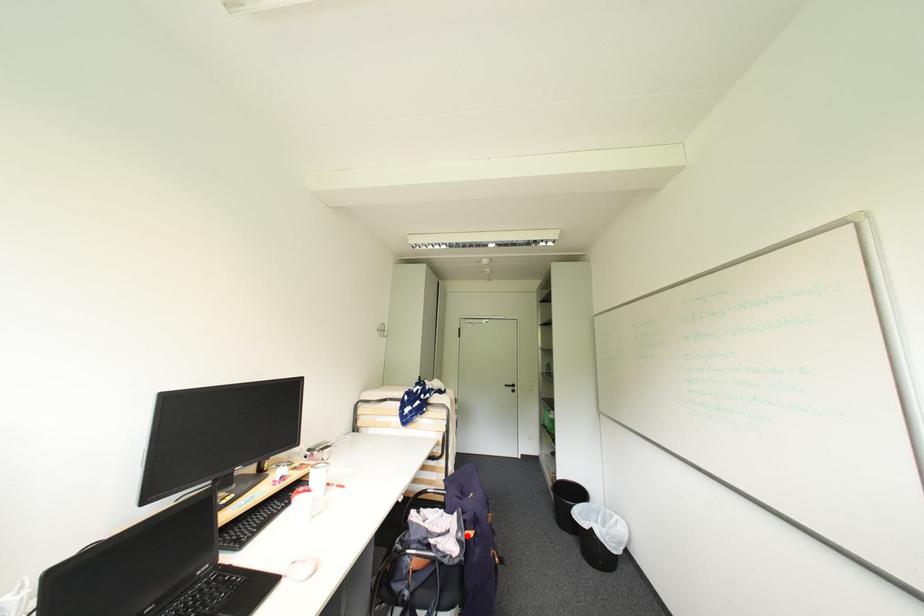
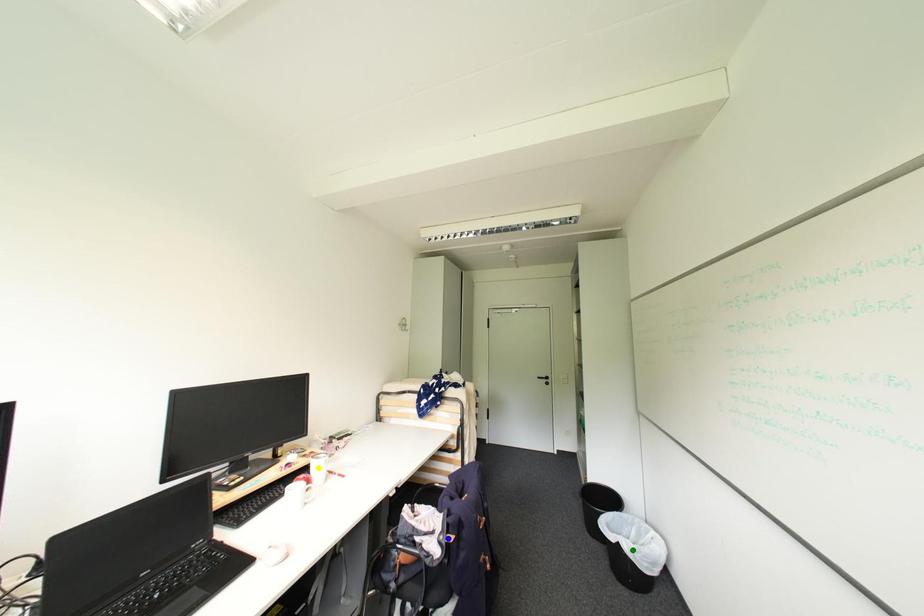
Question: I am providing you with two images of the same scene from different viewpoints. A red point is marked on the first image. You are given multiple points on the second image. In image 2, which mark is for the same physical point as the one in image 1?

Choices:
 (A) blue point
 (B) green point
 (C) yellow point

Answer: (A)